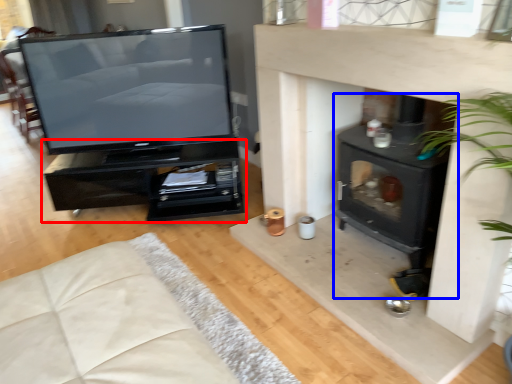
Question: Among these objects, which one is farthest to the camera, furniture (highlighted by a red box) or wood burning stove (highlighted by a blue box)?

Choices:
 (A) furniture
 (B) wood burning stove

Answer: (A)